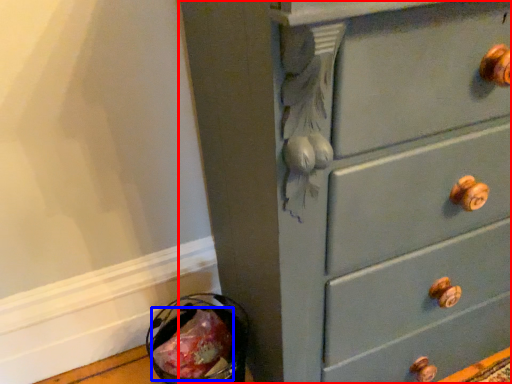
Question: Which object appears farthest to the camera in this image, chest of drawers (highlighted by a red box) or food (highlighted by a blue box)?

Choices:
 (A) chest of drawers
 (B) food

Answer: (B)